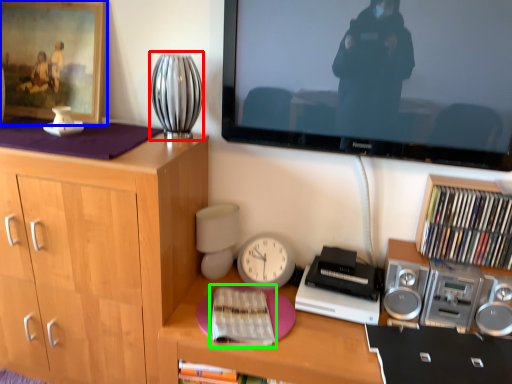
Question: Based on their relative distances, which object is nearer to table lamp (highlighted by a red box)? Choose from picture frame (highlighted by a blue box) and book (highlighted by a green box).

Choices:
 (A) picture frame
 (B) book

Answer: (A)